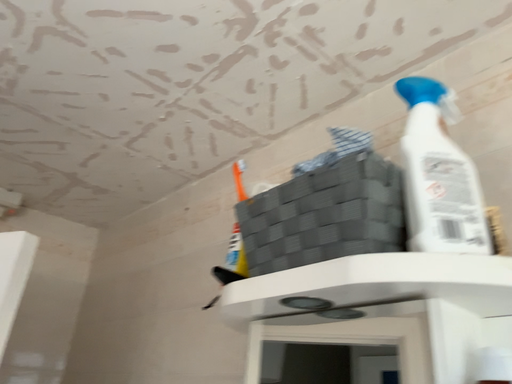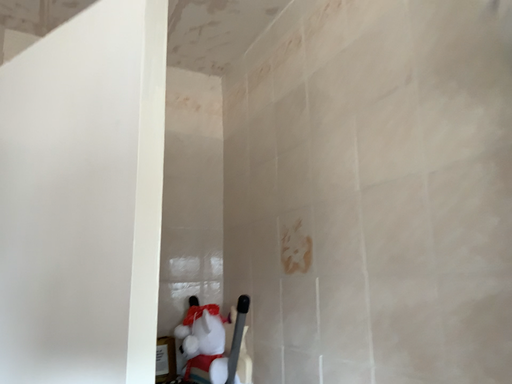
Question: How did the camera likely rotate when shooting the video?

Choices:
 (A) rotated downward
 (B) rotated upward

Answer: (A)